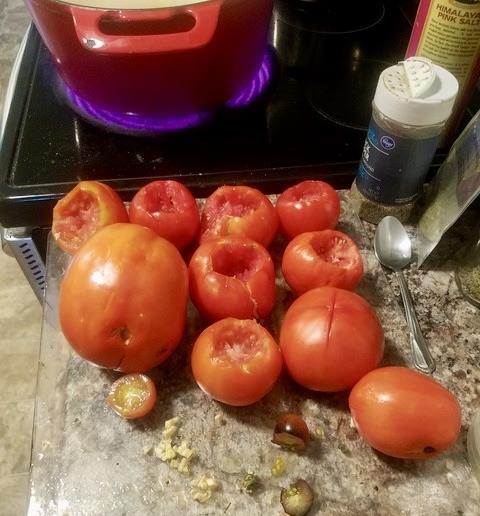
The width and height of the screenshot is (480, 516). I want to click on stove, so click(x=42, y=173).